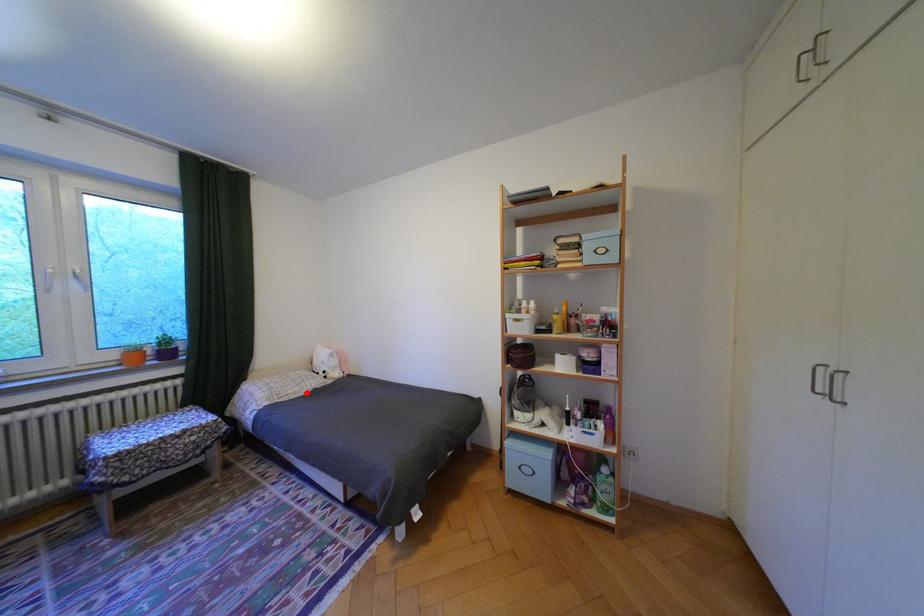
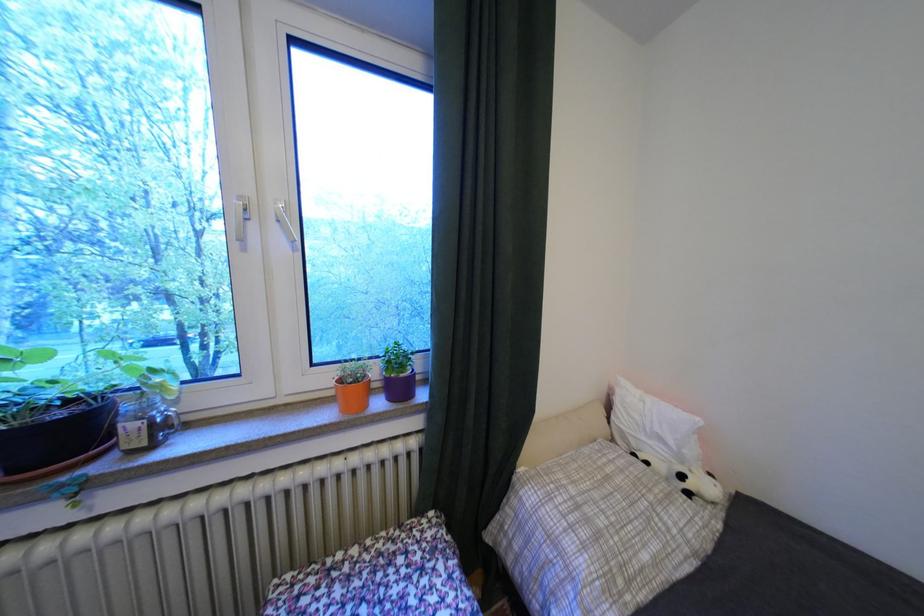
Question: I am providing you with two images of the same scene from different viewpoints. Image1 has a red point marked. In image2, the corresponding 3D location appears at what relative position? Reply with the corresponding letter.

Choices:
 (A) Closer
 (B) Farther

Answer: (A)